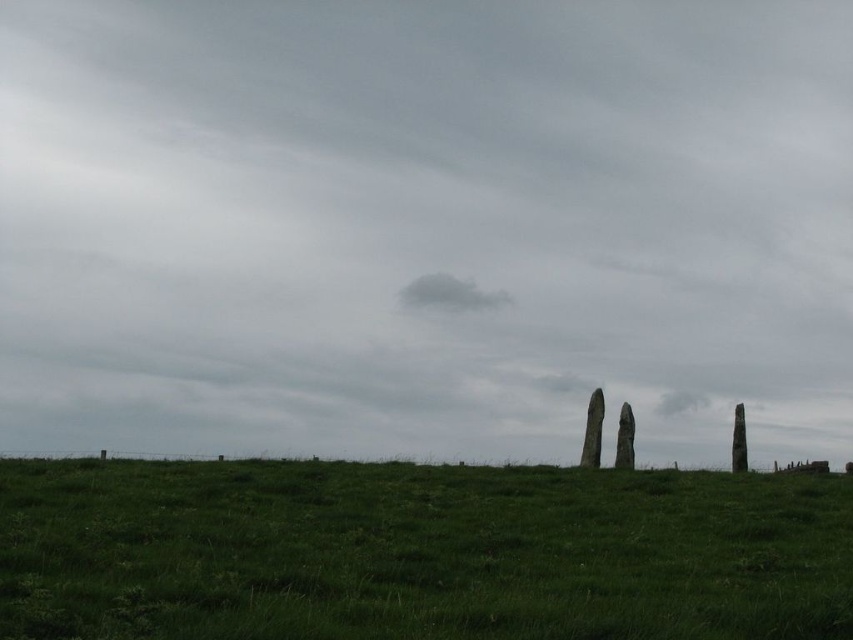
You are planning to set up a picnic blanket in the green grassy field at lower center. Considering the presence of the gray cotton cloud at center, will the cloud block sunlight over the picnic area?

The gray cotton cloud at center is located above the green grassy field at lower center. Since the cloud is in the sky above the field, it could potentially block sunlight, but the description does not specify the cloud size or position relative to the sun. However, the scene mentions an overcast sky, so the cloud might contribute to the already subdued lighting without casting a shadow specifically on the picnic area.

You are standing in a grassy field and looking up. You want to know what is directly above you at point coordinates (424, 225). What do you see?

At point coordinates (424, 225), you see the gray cloudy sky at upper center.

You are a photographer standing in the grassy field and want to capture both the point at coordinates (648, 144) and the point at (519, 541) in your shot. Which point is closer to your camera position?

The point at (519, 541) is closer to the camera because the point at (648, 144) is further away from the camera.